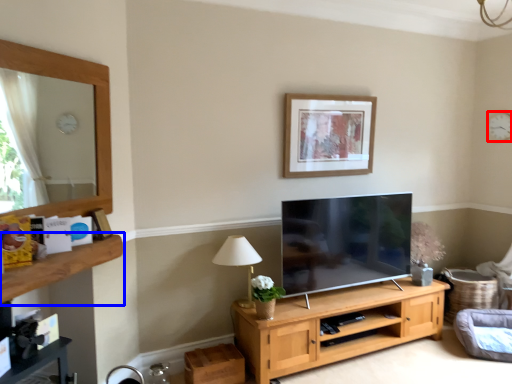
Question: Which object is closer to the camera taking this photo, clock (highlighted by a red box) or shelf (highlighted by a blue box)?

Choices:
 (A) clock
 (B) shelf

Answer: (B)